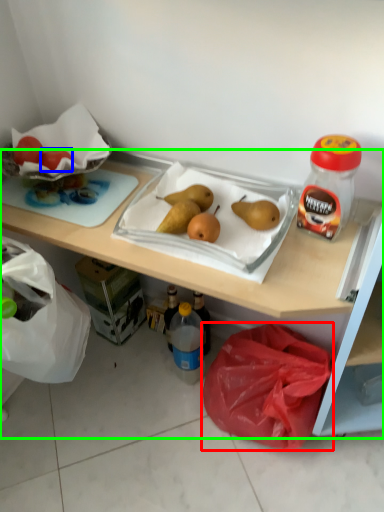
Question: Which is nearer to the plastic bag (highlighted by a red box)? grapefruit (highlighted by a blue box) or desk (highlighted by a green box).

Choices:
 (A) grapefruit
 (B) desk

Answer: (B)